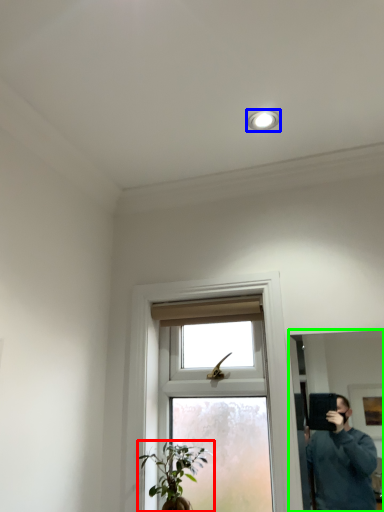
Question: Which object is the closest to the houseplant (highlighted by a red box)? Choose among these: light fixture (highlighted by a blue box) or mirror (highlighted by a green box).

Choices:
 (A) light fixture
 (B) mirror

Answer: (A)